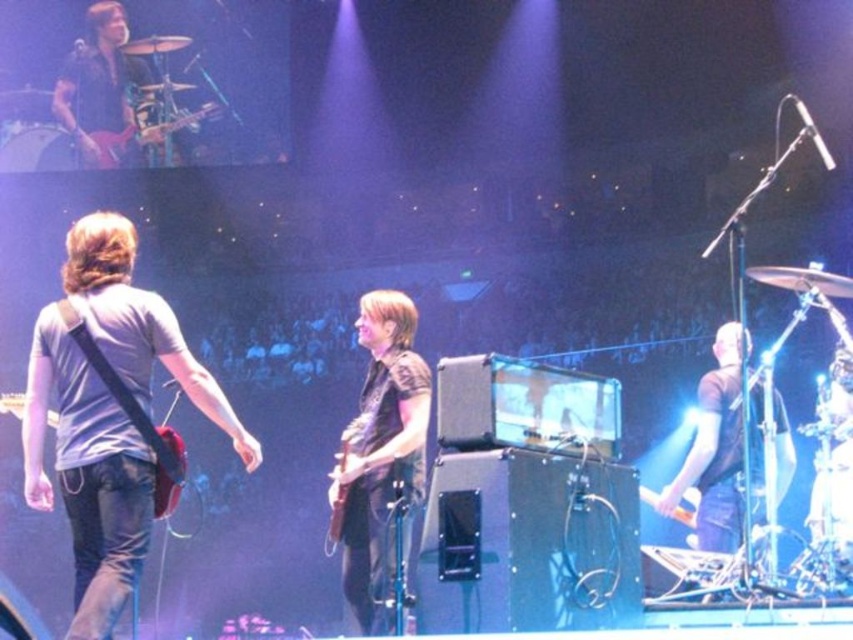
Does matte black guitar at left have a larger size compared to matte black electric guitar at left?

Indeed, matte black guitar at left has a larger size compared to matte black electric guitar at left.

Between point (164, 486) and point (107, 154), which one is positioned behind?

The point (107, 154) is behind.

Find the location of a particular element. This screenshot has width=853, height=640. matte black guitar at left is located at coordinates (165, 461).

Which of these two, gray matte t-shirt at center or shiny black guitar at upper left, stands shorter?

gray matte t-shirt at center

Is point (83, 500) more distant than point (102, 92)?

No, it is not.

I want to click on gray matte t-shirt at center, so click(x=88, y=474).

Which of these two, shiny black guitar at center or matte black electric guitar at left, stands shorter?

With less height is matte black electric guitar at left.

Describe the element at coordinates (381, 452) in the screenshot. Image resolution: width=853 pixels, height=640 pixels. I see `shiny black guitar at center` at that location.

Find the location of `shiny black guitar at center`. shiny black guitar at center is located at coordinates (381, 452).